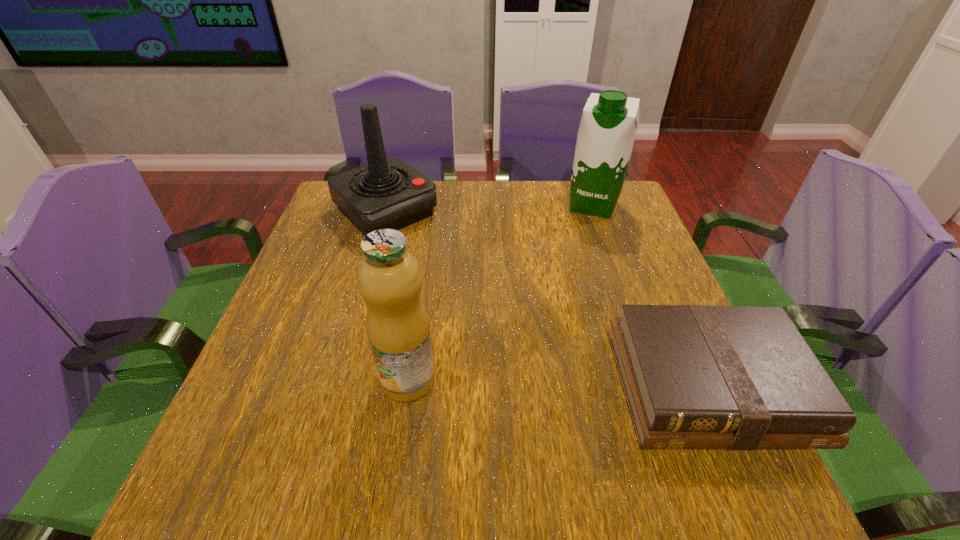
Find the location of a particular element. The width and height of the screenshot is (960, 540). free space located 0.290m on the front-facing side of the joystick is located at coordinates (482, 296).

What are the coordinates of `soya milk that is at the far edge` in the screenshot? It's located at (606, 135).

Image resolution: width=960 pixels, height=540 pixels. Find the location of `joystick at the far edge`. joystick at the far edge is located at coordinates (387, 193).

Locate an element on the screen. This screenshot has height=540, width=960. fruit juice that is at the near edge is located at coordinates (389, 279).

The height and width of the screenshot is (540, 960). I want to click on Bible present at the near edge, so click(694, 376).

Locate an element on the screen. This screenshot has height=540, width=960. object located at the left edge is located at coordinates (387, 193).

Where is `Bible situated at the right edge`? Bible situated at the right edge is located at coordinates (694, 376).

Where is `soya milk that is at the right edge`? soya milk that is at the right edge is located at coordinates (606, 135).

Locate an element on the screen. This screenshot has width=960, height=540. object present at the far left corner is located at coordinates (387, 193).

Find the location of a particular element. The width and height of the screenshot is (960, 540). object that is at the far right corner is located at coordinates (606, 135).